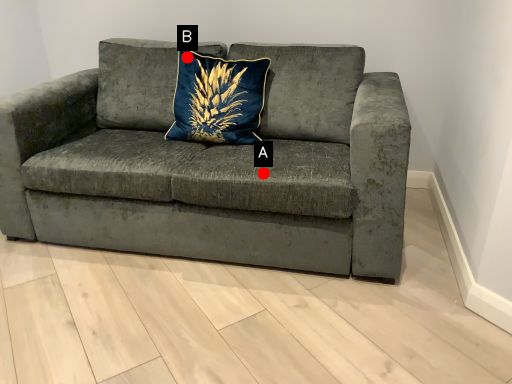
Question: Two points are circled on the image, labeled by A and B beside each circle. Which point is closer to the camera?

Choices:
 (A) A is closer
 (B) B is closer

Answer: (A)